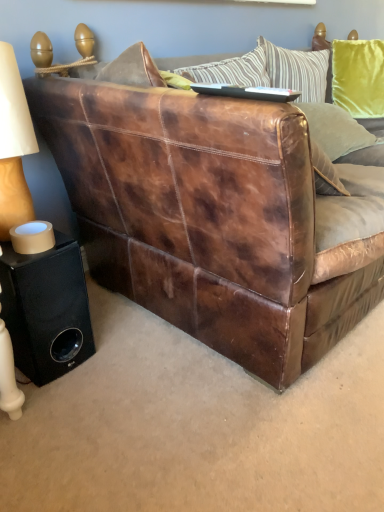
Image resolution: width=384 pixels, height=512 pixels. Describe the element at coordinates (209, 217) in the screenshot. I see `brown leather couch at center` at that location.

Image resolution: width=384 pixels, height=512 pixels. In order to click on velvet green pillow at upper right in this screenshot , I will do `click(335, 129)`.

Can we say velvet green pillow at upper right lies outside matte beige lampshade at left?

Absolutely, velvet green pillow at upper right is external to matte beige lampshade at left.

Measure the distance between velvet green pillow at upper right and matte beige lampshade at left.

A distance of 1.24 meters exists between velvet green pillow at upper right and matte beige lampshade at left.

Is point (357, 125) positioned before point (3, 240)?

No.

Is matte beige lampshade at left at the back of velvet green pillow at upper right?

No.

Is brown leather couch at center positioned with its back to velvet green pillow at upper right?

Absolutely, brown leather couch at center is directed away from velvet green pillow at upper right.

At what (x,y) coordinates should I click in order to perform the action: click on studio couch in front of the velvet green pillow at upper right. Please return your answer as a coordinate pair (x, y). Image resolution: width=384 pixels, height=512 pixels. Looking at the image, I should click on (209, 217).

Is brown leather couch at center shorter than velvet green pillow at upper right?

No, brown leather couch at center is not shorter than velvet green pillow at upper right.

Is brown leather couch at center spatially inside matte beige lampshade at left, or outside of it?

brown leather couch at center lies outside matte beige lampshade at left.

Does brown leather couch at center have a greater width compared to matte beige lampshade at left?

Correct, the width of brown leather couch at center exceeds that of matte beige lampshade at left.

Which object is positioned more to the left, brown leather couch at center or matte beige lampshade at left?

From the viewer's perspective, matte beige lampshade at left appears more on the left side.

Which object is further away from the camera, brown leather couch at center or matte beige lampshade at left?

matte beige lampshade at left is further away from the camera.

In the scene shown: From a real-world perspective, is matte beige lampshade at left above or below brown leather couch at center?

In terms of real-world spatial position, matte beige lampshade at left is above brown leather couch at center.

Where is `studio couch above the matte beige lampshade at left (from the image's perspective)`? Image resolution: width=384 pixels, height=512 pixels. studio couch above the matte beige lampshade at left (from the image's perspective) is located at coordinates (209, 217).

Who is taller, matte beige lampshade at left or black matte speaker at lower left?

matte beige lampshade at left.

Is matte beige lampshade at left looking in the opposite direction of black matte speaker at lower left?

No, matte beige lampshade at left's orientation is not away from black matte speaker at lower left.

How many degrees apart are the facing directions of matte beige lampshade at left and black matte speaker at lower left?

4.4 degrees separate the facing orientations of matte beige lampshade at left and black matte speaker at lower left.

From a real-world perspective, who is located higher, matte beige lampshade at left or black matte speaker at lower left?

From a 3D spatial view, matte beige lampshade at left is above.

Is matte beige lampshade at left located within black matte speaker at lower left?

No.

Does black matte speaker at lower left have a greater height compared to matte beige lampshade at left?

In fact, black matte speaker at lower left may be shorter than matte beige lampshade at left.

Which point is more distant from viewer, (77, 289) or (11, 181)?

Point (77, 289)

From the image's perspective, does black matte speaker at lower left appear lower than matte beige lampshade at left?

Yes, from the image's perspective, black matte speaker at lower left is beneath matte beige lampshade at left.

From a real-world perspective, is brown leather couch at center below black matte speaker at lower left?

Incorrect, from a real-world perspective, brown leather couch at center is higher than black matte speaker at lower left.

Does brown leather couch at center have a lesser height compared to black matte speaker at lower left?

In fact, brown leather couch at center may be taller than black matte speaker at lower left.

Does brown leather couch at center have a larger size compared to black matte speaker at lower left?

Yes.

Are brown leather couch at center and black matte speaker at lower left located far from each other?

No, brown leather couch at center is in close proximity to black matte speaker at lower left.

At what (x,y) coordinates should I click in order to perform the action: click on table lamp to the left of velvet green pillow at upper right. Please return your answer as a coordinate pair (x, y). The image size is (384, 512). Looking at the image, I should click on (14, 145).

Locate an element on the screen. studio couch below the velvet green pillow at upper right (from the image's perspective) is located at coordinates (209, 217).

Considering their positions, is brown leather couch at center positioned closer to matte beige lampshade at left than velvet green pillow at upper right?

Based on the image, brown leather couch at center appears to be nearer to matte beige lampshade at left.

Based on their spatial positions, is black matte speaker at lower left or matte beige lampshade at left closer to velvet green pillow at upper right?

black matte speaker at lower left is positioned closer to the anchor velvet green pillow at upper right.

Considering their positions, is matte beige lampshade at left positioned further to black matte speaker at lower left than velvet green pillow at upper right?

Among the two, velvet green pillow at upper right is located further to black matte speaker at lower left.

From the image, which object appears to be nearer to brown leather couch at center, black matte speaker at lower left or velvet green pillow at upper right?

black matte speaker at lower left is closer to brown leather couch at center.

Looking at the image, which one is located further to matte beige lampshade at left, black matte speaker at lower left or brown leather couch at center?

brown leather couch at center is positioned further to the anchor matte beige lampshade at left.

When comparing their distances from matte beige lampshade at left, does black matte speaker at lower left or velvet green pillow at upper right seem closer?

The object closer to matte beige lampshade at left is black matte speaker at lower left.

Based on their spatial positions, is brown leather couch at center or black matte speaker at lower left further from matte beige lampshade at left?

brown leather couch at center is positioned further to the anchor matte beige lampshade at left.

From the image, which object appears to be nearer to velvet green pillow at upper right, brown leather couch at center or matte beige lampshade at left?

brown leather couch at center lies closer to velvet green pillow at upper right than the other object.

Identify the location of studio couch between matte beige lampshade at left and velvet green pillow at upper right from left to right. 209,217.

Locate an element on the screen. This screenshot has width=384, height=512. speaker between matte beige lampshade at left and brown leather couch at center from left to right is located at coordinates (46, 309).

Where is `speaker situated between matte beige lampshade at left and velvet green pillow at upper right from left to right`? This screenshot has width=384, height=512. speaker situated between matte beige lampshade at left and velvet green pillow at upper right from left to right is located at coordinates (46, 309).

The height and width of the screenshot is (512, 384). In order to click on studio couch located between black matte speaker at lower left and velvet green pillow at upper right in the left-right direction in this screenshot , I will do `click(209, 217)`.